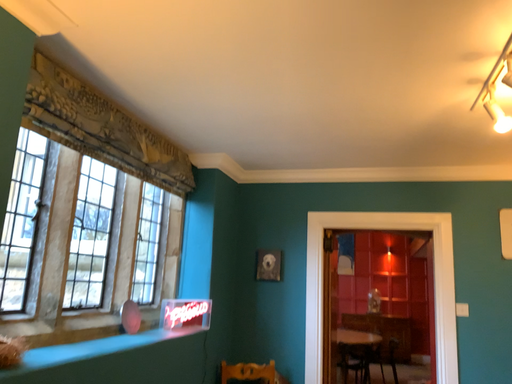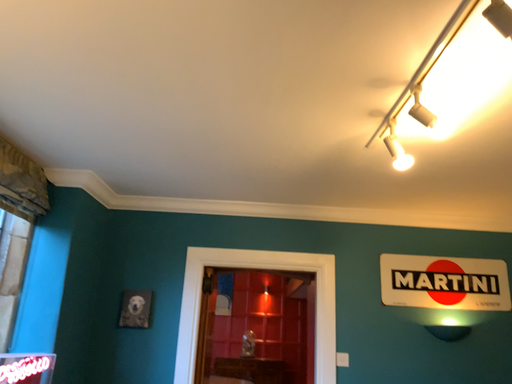
Question: How did the camera likely rotate when shooting the video?

Choices:
 (A) rotated left
 (B) rotated right

Answer: (B)